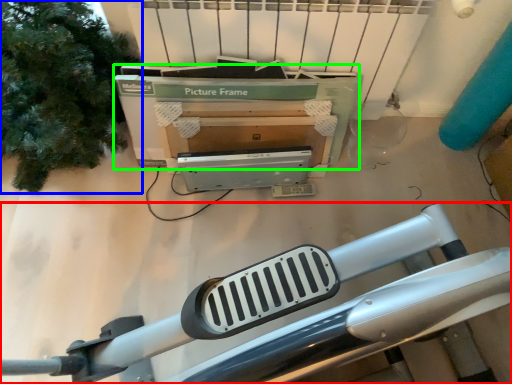
Question: Which object is the closest to the furniture (highlighted by a red box)? Choose among these: tree (highlighted by a blue box) or box (highlighted by a green box).

Choices:
 (A) tree
 (B) box

Answer: (B)